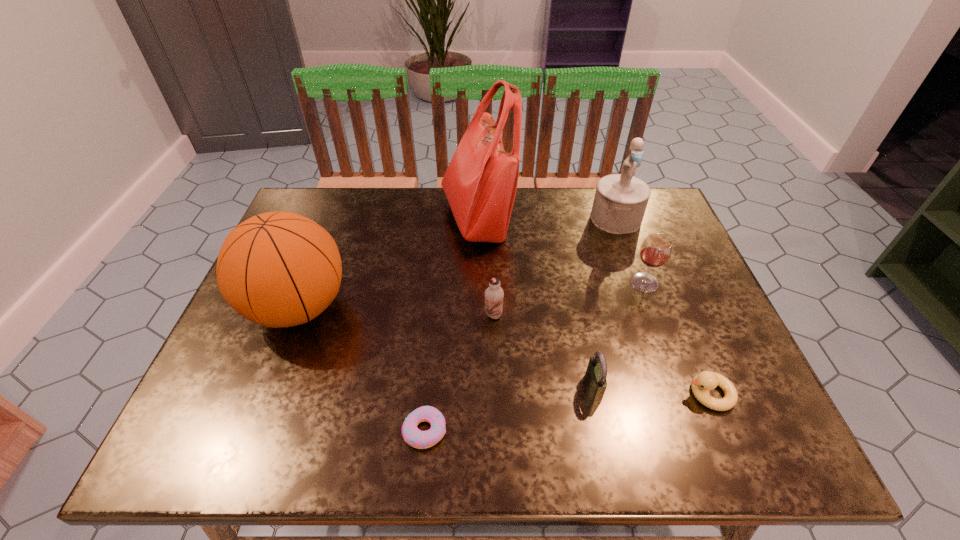
Identify the location of vacant space at the far right corner. (653, 222).

You are a GUI agent. You are given a task and a screenshot of the screen. Output one action in this format:
    pyautogui.click(x=<x>, y=<y>)
    Task: Click on the empty space between the handbag and the wineglass
    This screenshot has width=960, height=540.
    Given the screenshot: What is the action you would take?
    pyautogui.click(x=561, y=251)

You are a GUI agent. You are given a task and a screenshot of the screen. Output one action in this format:
    pyautogui.click(x=<x>, y=<y>)
    Task: Click on the vacant space in between the duckling and the figurine
    Image resolution: width=960 pixels, height=540 pixels.
    Given the screenshot: What is the action you would take?
    pyautogui.click(x=662, y=306)

Where is `blank region between the leftmost object and the shortest object`? Image resolution: width=960 pixels, height=540 pixels. blank region between the leftmost object and the shortest object is located at coordinates (362, 369).

Locate an element on the screen. The width and height of the screenshot is (960, 540). vacant area that lies between the wineglass and the seventh tallest object is located at coordinates (x=677, y=338).

The width and height of the screenshot is (960, 540). Find the location of `vacant space that is in between the shortest object and the basketball`. vacant space that is in between the shortest object and the basketball is located at coordinates (362, 369).

You are a GUI agent. You are given a task and a screenshot of the screen. Output one action in this format:
    pyautogui.click(x=<x>, y=<y>)
    Task: Click on the empty space that is in between the figurine and the shortest object
    
    Given the screenshot: What is the action you would take?
    pyautogui.click(x=520, y=325)

Image resolution: width=960 pixels, height=540 pixels. Identify the location of free point between the duckling and the doughnut. (567, 412).

Find the location of `blank region between the figurine and the shortest object`. blank region between the figurine and the shortest object is located at coordinates point(520,325).

The image size is (960, 540). Identify the location of vacant region between the leftmost object and the tallest object. (388, 263).